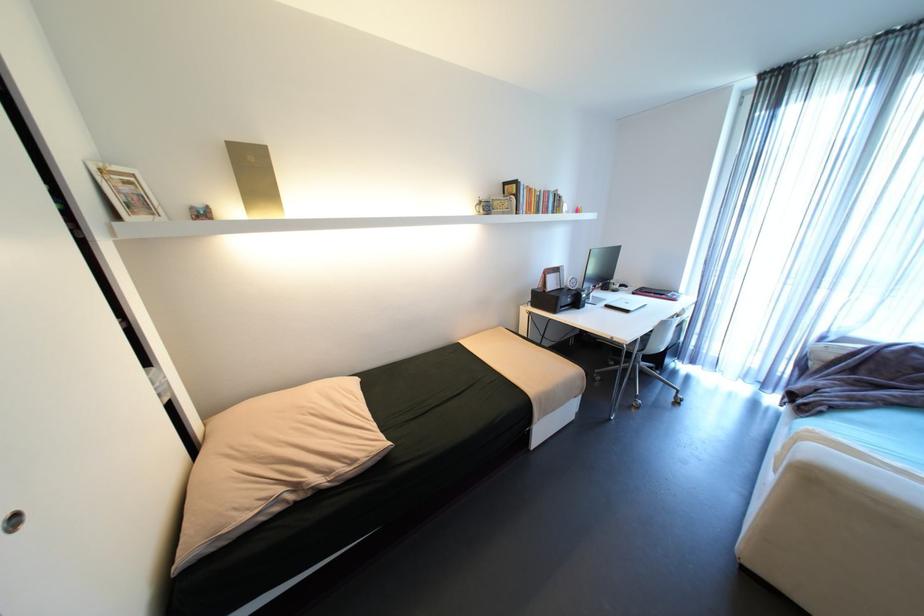
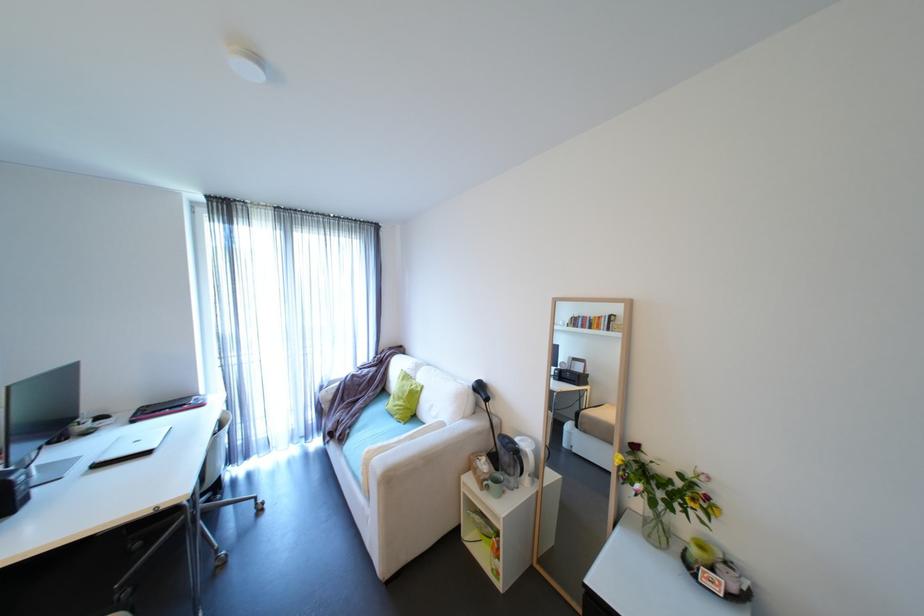
The point at (x=810, y=408) is marked in the first image. Where is the corresponding point in the second image?

(347, 438)